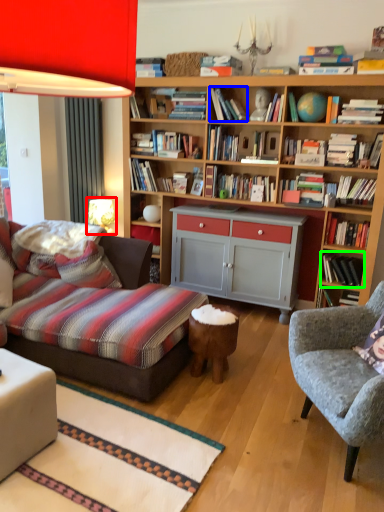
Question: Which object is positioned closest to table lamp (highlighted by a red box)? Select from book (highlighted by a blue box) and book (highlighted by a green box).

Choices:
 (A) book
 (B) book

Answer: (A)